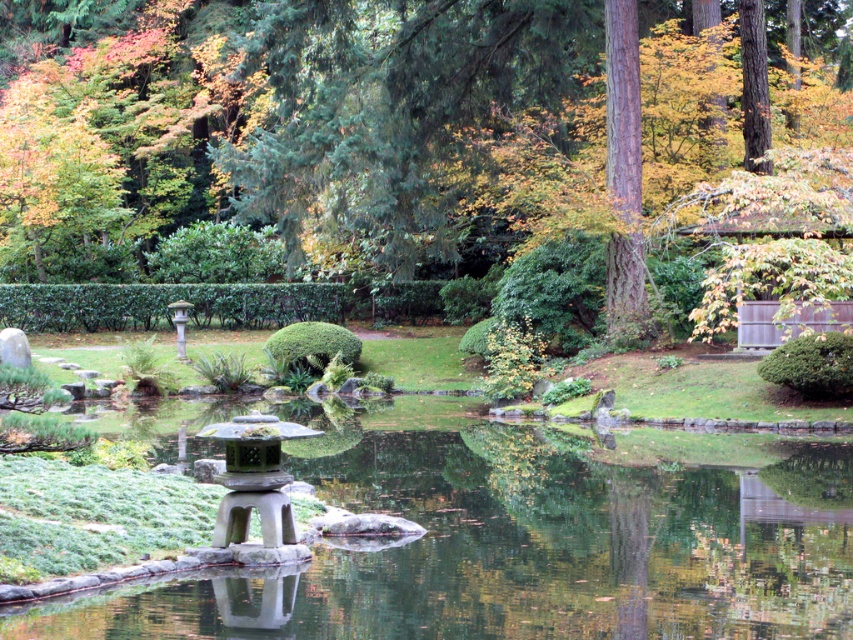
Based on the photo, you are a landscape architect designing a walking path that must pass between the green leafy hedge at center and the smooth stone lantern at center. The path needs to be at least 3 meters wide to accommodate visitors comfortably. Based on the scene, will this width requirement be met?

The distance between the green leafy hedge at center and the smooth stone lantern at center is 34.05 meters, so the path can easily be 3 meters wide as the distance is much larger than the required width.

You are a gardener planning to place a new decorative item in the Japanese garden. You need to ensure it fits between the brown textured tree at upper center and the green stone water at center. If the item is 2 meters wide, will it fit? Please explain using the objects mentioned.

The brown textured tree at upper center is wider than the green stone water at center. Since the item is 2 meters wide, it depends on the actual width of the space between them. However, since the tree is wider, the space between might be narrower than the tree itself. Without exact measurements, we cannot confirm if the 2m item will fit. Please measure the space first.

You are a visitor in the Japanese garden and want to take a photo that includes both the brown textured tree at upper center and the green stone water at center. Which object should you position closer to the front of your camera frame to ensure both are in focus?

The brown textured tree at upper center is much taller than the green stone water at center, so to ensure both are in focus, position the green stone water at center closer to the front of your camera frame. This way, the tree will naturally appear smaller in the background while maintaining depth of field for both subjects.